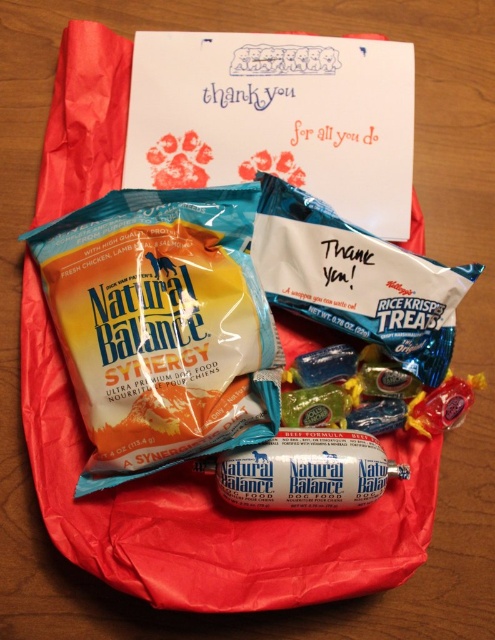
Does point (179, 189) come farther from viewer compared to point (293, 488)?

Yes, it is.

Is blue matte bag of natural balance synergy at upper left positioned at the back of white glossy dog food at center?

No, blue matte bag of natural balance synergy at upper left is in front of white glossy dog food at center.

Which is in front, point (111, 328) or point (252, 488)?

Point (111, 328) is more forward.

This screenshot has height=640, width=495. I want to click on blue matte bag of natural balance synergy at upper left, so click(161, 326).